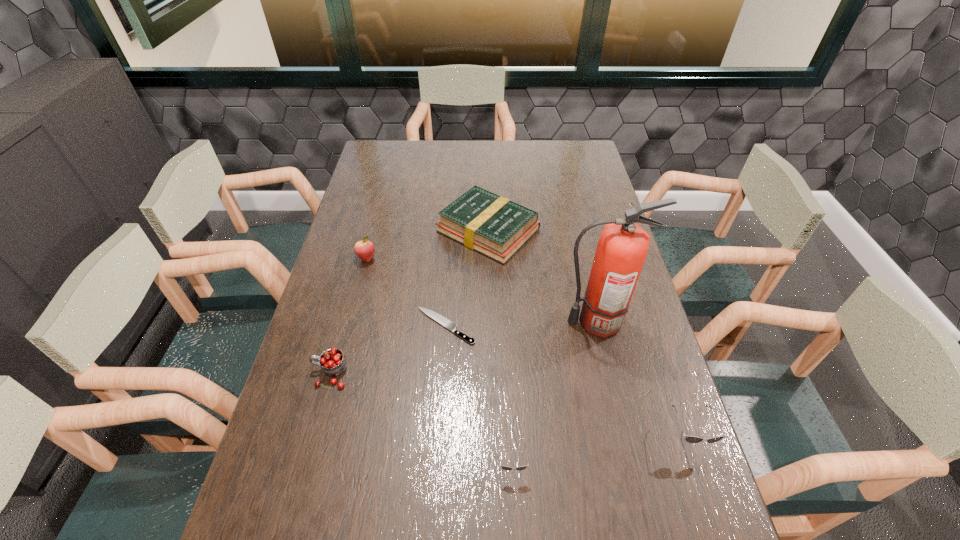
Please point a free position for a sunglasses on the left. Please provide its 2D coordinates. Your answer should be formatted as a tuple, i.e. [(x, y)], where the tuple contains the x and y coordinates of a point satisfying the conditions above.

[(321, 495)]